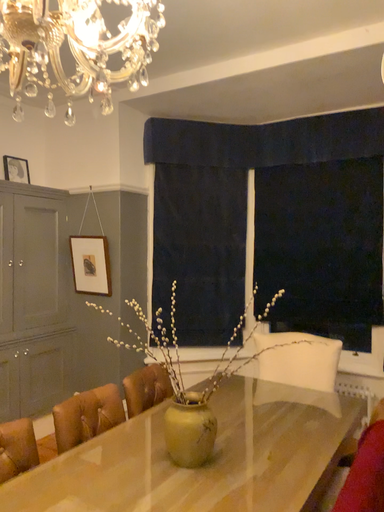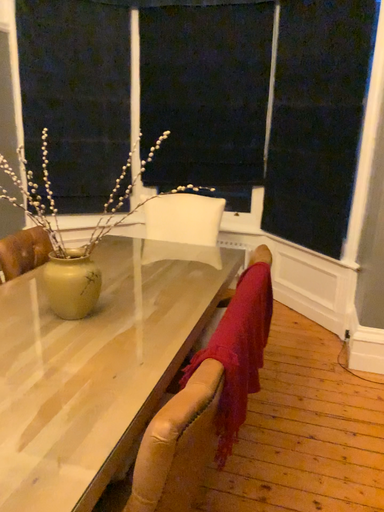
Question: Which way did the camera rotate in the video?

Choices:
 (A) rotated right
 (B) rotated left

Answer: (A)